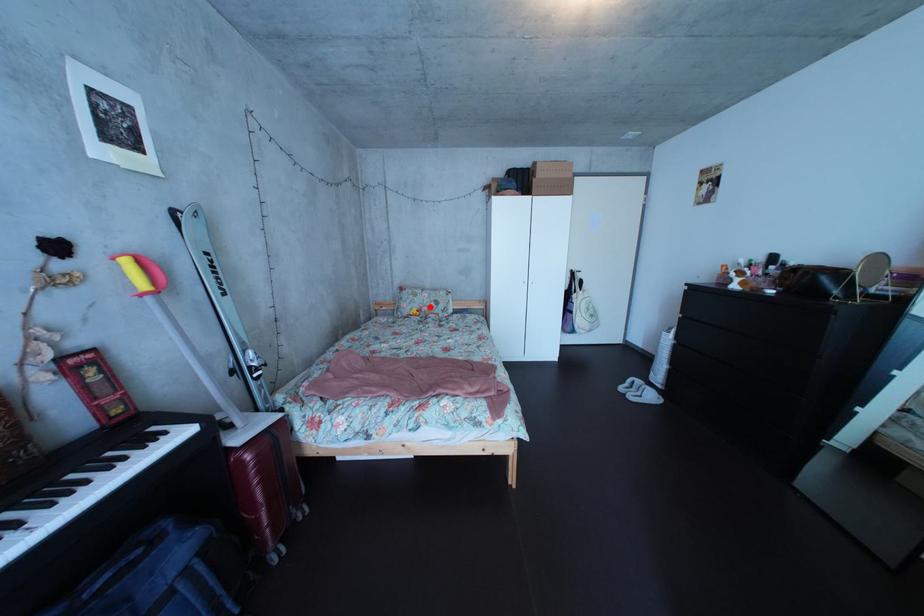
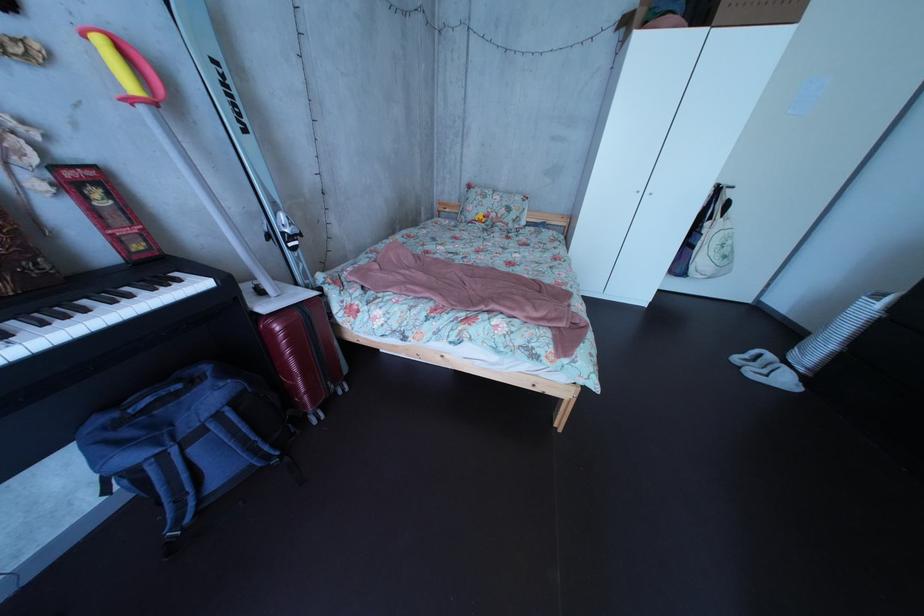
Locate, in the second image, the point that corresponds to the highlighted location in the first image.

(499, 209)